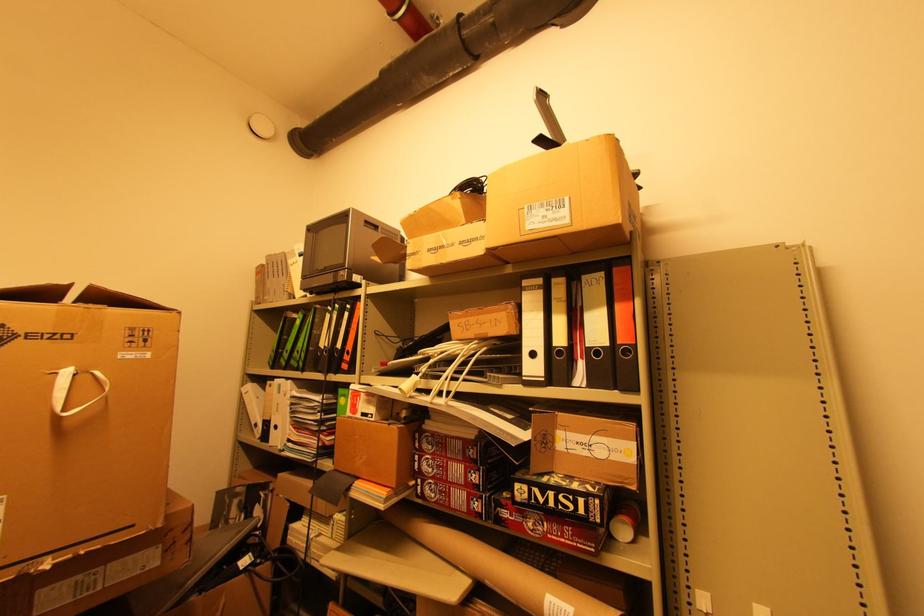
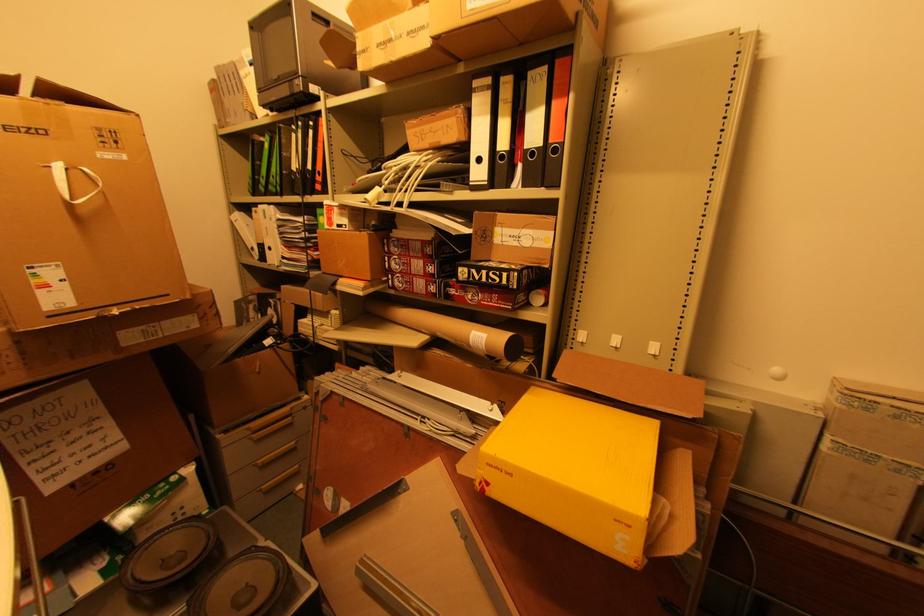
What movement of the cameraman would produce the second image?

The cameraman walked toward right, backward.